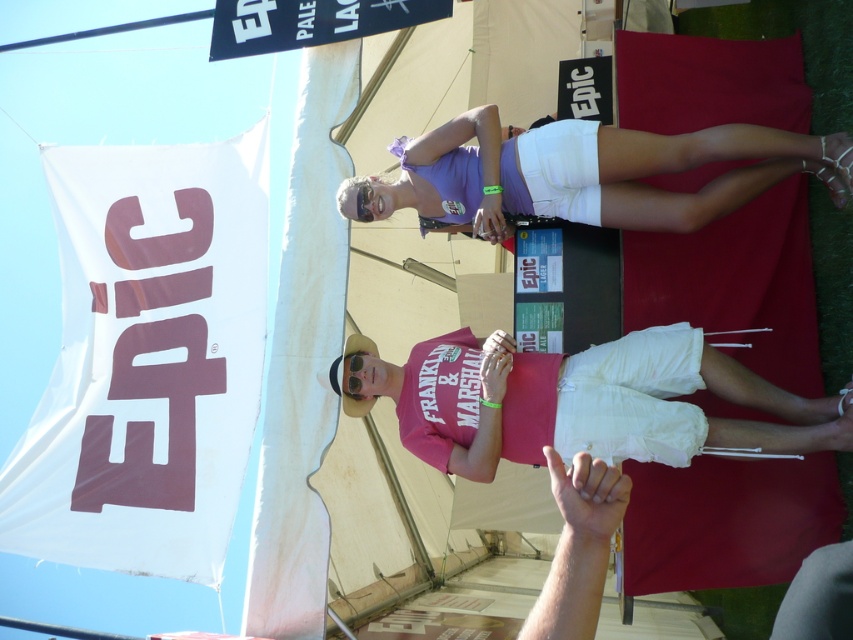
Question: Does pink cotton shirt at center appear on the right side of purple fabric shorts at upper center?

Choices:
 (A) no
 (B) yes

Answer: (A)

Question: Which point is farther to the camera?

Choices:
 (A) tap(476, 432)
 (B) tap(498, 186)

Answer: (B)

Question: Does pink cotton shirt at center appear over purple fabric shorts at upper center?

Choices:
 (A) no
 (B) yes

Answer: (A)

Question: Is pink cotton shirt at center positioned before purple fabric shorts at upper center?

Choices:
 (A) no
 (B) yes

Answer: (B)